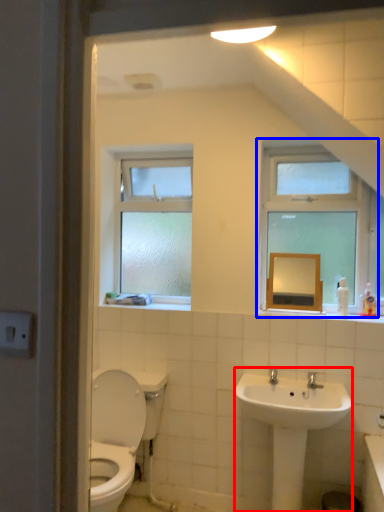
Question: Which of the following is the closest to the observer, sink (highlighted by a red box) or window (highlighted by a blue box)?

Choices:
 (A) sink
 (B) window

Answer: (A)